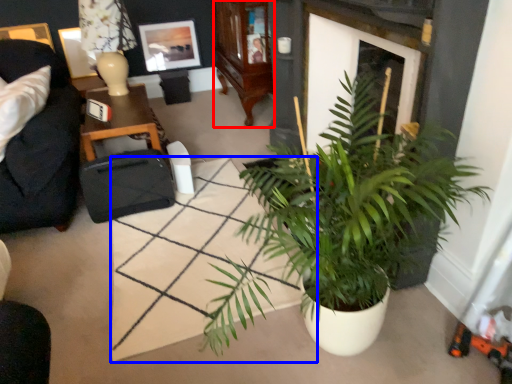
Question: Which object appears farthest to the camera in this image, cabinetry (highlighted by a red box) or square (highlighted by a blue box)?

Choices:
 (A) cabinetry
 (B) square

Answer: (A)